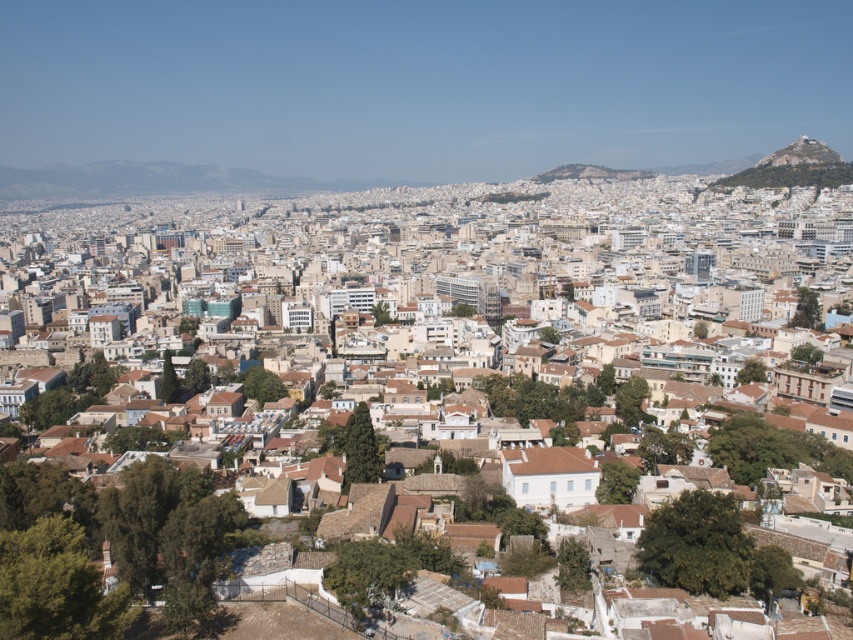
You are a drone operator tasked with capturing aerial footage of the city. Your drone is currently hovering above the white textured buildings at center. To get a better shot of the rustic stone peak at upper right, should you fly upwards or downwards?

The white textured buildings at center is below the rustic stone peak at upper right, so to capture the peak, you should fly upwards.

You are an urban planner assessing the cityscape. You need to determine which structure is taller between the white textured buildings at center and the rustic stone peak at upper right. Based on the scene, which one is taller?

The white textured buildings at center is taller than rustic stone peak at upper right according to the description.

You are an urban planner assessing the city layout. You need to determine which structure occupies more space in the image between the white textured buildings at center and the rustic stone peak at upper right. Which one is larger?

The white textured buildings at center is bigger than rustic stone peak at upper right, so the white textured buildings at center occupies more space in the image.